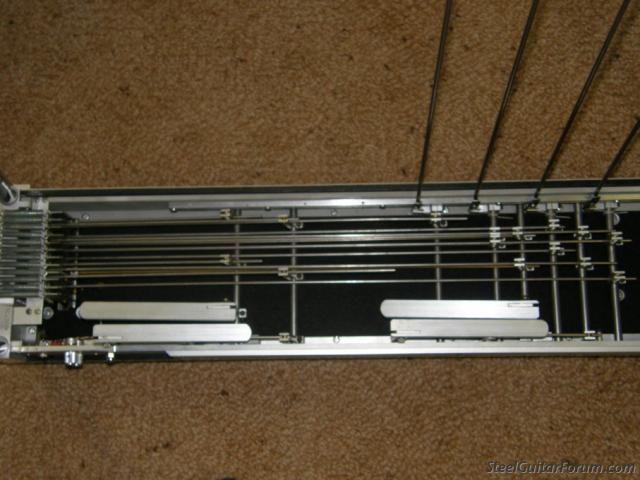
The width and height of the screenshot is (640, 480). Identify the location of brown carpeting. (331, 427), (321, 102).